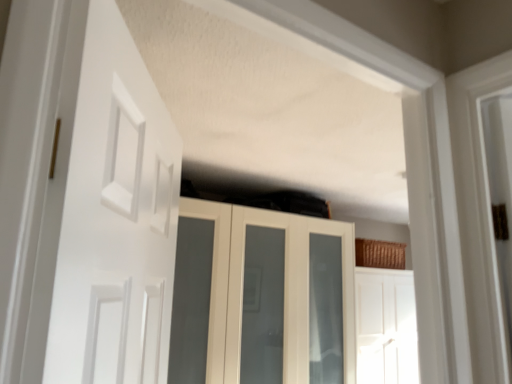
In order to face white glossy cupboard at upper center, should I rotate leftwards or rightwards?

Turn left by 0.204 degrees to look at white glossy cupboard at upper center.

Locate an element on the screen. The height and width of the screenshot is (384, 512). white matte door at left, which is counted as the second door, starting from the right is located at coordinates (111, 212).

Find the location of a particular element. The width and height of the screenshot is (512, 384). white glossy door at center, the 2th door viewed from the front is located at coordinates (386, 327).

Is white glossy cupboard at upper center situated inside white glossy door at center, placed as the first door when sorted from back to front, or outside?

white glossy cupboard at upper center is located beyond the bounds of white glossy door at center, placed as the first door when sorted from back to front.

Is white glossy cupboard at upper center aimed at white glossy door at center, the second door in the top-to-bottom sequence?

No, white glossy cupboard at upper center is not facing towards white glossy door at center, the second door in the top-to-bottom sequence.

From the image's perspective, is white glossy cupboard at upper center positioned above or below white glossy door at center, the second door in the top-to-bottom sequence?

white glossy cupboard at upper center is above white glossy door at center, the second door in the top-to-bottom sequence.

Which object is positioned more to the left, white glossy cupboard at upper center or white glossy door at center, the second door in the top-to-bottom sequence?

white glossy cupboard at upper center.

Is white glossy door at center, the 2th door viewed from the front, to the right of white matte door at left, which is counted as the second door, starting from the right, from the viewer's perspective?

Indeed, white glossy door at center, the 2th door viewed from the front, is positioned on the right side of white matte door at left, which is counted as the second door, starting from the right.

Is white glossy door at center, marked as the second door in a left-to-right arrangement, bigger than white matte door at left, which appears as the first door when viewed from the front?

Yes, white glossy door at center, marked as the second door in a left-to-right arrangement, is bigger than white matte door at left, which appears as the first door when viewed from the front.

Could white matte door at left, which appears as the 1th door when viewed from the top, be considered to be inside white glossy door at center, which ranks as the 1th door in bottom-to-top order?

No.

Can you confirm if white glossy door at center, placed as the first door when sorted from back to front, is wider than white matte door at left, which appears as the first door when viewed from the front?

Indeed, white glossy door at center, placed as the first door when sorted from back to front, has a greater width compared to white matte door at left, which appears as the first door when viewed from the front.

In the image, is white glossy cupboard at upper center on the left side or the right side of white matte door at left, which is counted as the second door, starting from the right?

white glossy cupboard at upper center is to the right of white matte door at left, which is counted as the second door, starting from the right.

What's the angular difference between white glossy cupboard at upper center and white matte door at left, which is counted as the second door, starting from the bottom,'s facing directions?

They differ by 56.3 degrees in their facing directions.

Is white glossy cupboard at upper center located outside white matte door at left, which appears as the 1th door when viewed from the top?

white glossy cupboard at upper center lies outside white matte door at left, which appears as the 1th door when viewed from the top,'s area.

Consider the image. Is white matte door at left, which is counted as the second door, starting from the right, turned away from white glossy cupboard at upper center?

No, white matte door at left, which is counted as the second door, starting from the right, is not facing the opposite direction of white glossy cupboard at upper center.

Find the location of a particular element. The width and height of the screenshot is (512, 384). door that is in front of the white glossy cupboard at upper center is located at coordinates (111, 212).

From a real-world perspective, is white matte door at left, which is counted as the second door, starting from the right, below white glossy cupboard at upper center?

No.

Which of these two, white glossy door at center, which ranks as the 1th door in bottom-to-top order, or white glossy cupboard at upper center, stands taller?

white glossy cupboard at upper center is taller.

Find the location of a particular element. Image resolution: width=512 pixels, height=384 pixels. door directly beneath the white glossy cupboard at upper center (from a real-world perspective) is located at coordinates (386, 327).

Measure the distance from white glossy door at center, the 2th door viewed from the front, to white glossy cupboard at upper center.

The distance of white glossy door at center, the 2th door viewed from the front, from white glossy cupboard at upper center is 26.23 inches.

Considering the relative sizes of white glossy door at center, marked as the second door in a left-to-right arrangement, and white glossy cupboard at upper center in the image provided, is white glossy door at center, marked as the second door in a left-to-right arrangement, smaller than white glossy cupboard at upper center?

Indeed, white glossy door at center, marked as the second door in a left-to-right arrangement, has a smaller size compared to white glossy cupboard at upper center.

Is white matte door at left, which is counted as the second door, starting from the right, looking in the opposite direction of white glossy door at center, arranged as the first door when viewed from the right?

No, white glossy door at center, arranged as the first door when viewed from the right, is not at the back of white matte door at left, which is counted as the second door, starting from the right.

Considering the relative positions of white matte door at left, which appears as the 1th door when viewed from the top, and white glossy door at center, which ranks as the 1th door in bottom-to-top order, in the image provided, is white matte door at left, which appears as the 1th door when viewed from the top, in front of white glossy door at center, which ranks as the 1th door in bottom-to-top order,?

Yes, white matte door at left, which appears as the 1th door when viewed from the top, is closer to the viewer.

Considering the positions of objects white matte door at left, the 1th door when ordered from left to right, and white glossy door at center, placed as the first door when sorted from back to front, in the image provided, who is more to the right, white matte door at left, the 1th door when ordered from left to right, or white glossy door at center, placed as the first door when sorted from back to front,?

Positioned to the right is white glossy door at center, placed as the first door when sorted from back to front.

In the scene shown: Would you consider white matte door at left, which appears as the first door when viewed from the front, to be distant from white glossy door at center, the 2th door viewed from the front?

Yes, white matte door at left, which appears as the first door when viewed from the front, is far from white glossy door at center, the 2th door viewed from the front.

Where is `cupboard above the white glossy door at center, marked as the second door in a left-to-right arrangement (from a real-world perspective)`? The image size is (512, 384). cupboard above the white glossy door at center, marked as the second door in a left-to-right arrangement (from a real-world perspective) is located at coordinates (262, 297).

Identify the location of door that is behind the white matte door at left, which is counted as the second door, starting from the right. This screenshot has height=384, width=512. (386, 327).

Estimate the real-world distances between objects in this image. Which object is further from white matte door at left, which appears as the 1th door when viewed from the top, white glossy door at center, the second door in the top-to-bottom sequence, or white glossy cupboard at upper center?

Among the two, white glossy door at center, the second door in the top-to-bottom sequence, is located further to white matte door at left, which appears as the 1th door when viewed from the top.

Which object lies further to the anchor point white matte door at left, which appears as the 1th door when viewed from the top, white glossy cupboard at upper center or white glossy door at center, the second door in the top-to-bottom sequence?

white glossy door at center, the second door in the top-to-bottom sequence, is further to white matte door at left, which appears as the 1th door when viewed from the top.

Estimate the real-world distances between objects in this image. Which object is further from white glossy door at center, placed as the first door when sorted from back to front, white matte door at left, which appears as the 1th door when viewed from the top, or white glossy cupboard at upper center?

white matte door at left, which appears as the 1th door when viewed from the top, is further to white glossy door at center, placed as the first door when sorted from back to front.

Estimate the real-world distances between objects in this image. Which object is further from white glossy cupboard at upper center, white glossy door at center, marked as the second door in a left-to-right arrangement, or white matte door at left, the 2th door in the back-to-front sequence?

white matte door at left, the 2th door in the back-to-front sequence, lies further to white glossy cupboard at upper center than the other object.

In the scene shown: Considering their positions, is white matte door at left, which is counted as the second door, starting from the right, positioned closer to white glossy cupboard at upper center than white glossy door at center, the second door in the top-to-bottom sequence?

white glossy door at center, the second door in the top-to-bottom sequence, is positioned closer to the anchor white glossy cupboard at upper center.

When comparing their distances from white glossy door at center, the second door in the top-to-bottom sequence, does white glossy cupboard at upper center or white matte door at left, which is counted as the second door, starting from the right, seem further?

The object further to white glossy door at center, the second door in the top-to-bottom sequence, is white matte door at left, which is counted as the second door, starting from the right.

Identify the location of cupboard located between white matte door at left, which appears as the first door when viewed from the front, and white glossy door at center, marked as the second door in a left-to-right arrangement, in the depth direction. The width and height of the screenshot is (512, 384). (262, 297).